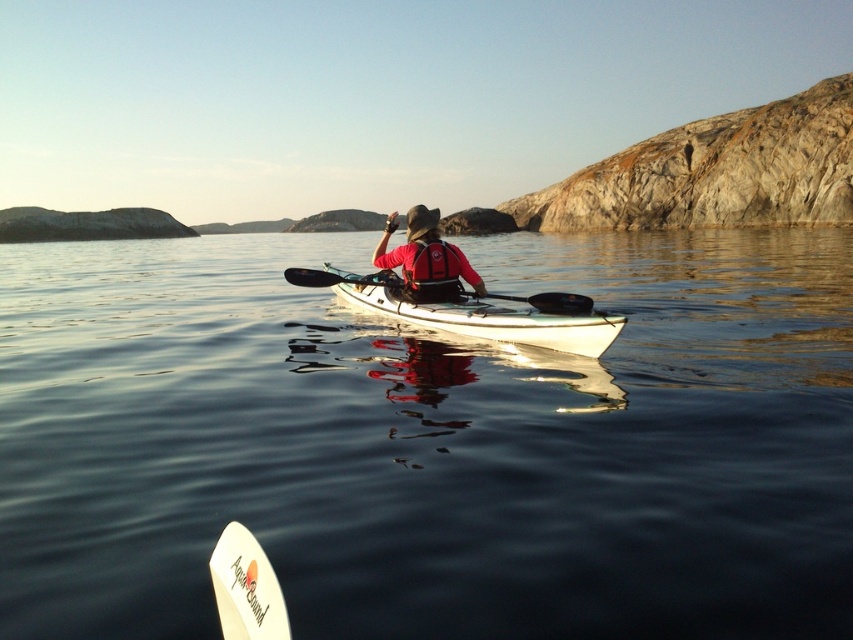
From the picture: You are a photographer trying to capture the kayaker in the scene. You want to position your camera so that the white foam surfboard at lower left is on the right side of the frame and the clear water at center is on the left side. Is this possible based on their current positions?

Yes, because the clear water at center is to the left of the white foam surfboard at lower left, so positioning the camera to frame the surfboard on the right and water on the left aligns with their existing spatial relationship.

You are navigating a kayak and want to reach a destination located at point (437,488). There is an obstacle at point (553,301). Based on the scene description, will you collide with the obstacle if you continue moving straight ahead?

Point (437,488) is in front of point (553,301), so if you continue moving straight ahead towards your destination, you will pass in front of the obstacle and avoid collision.